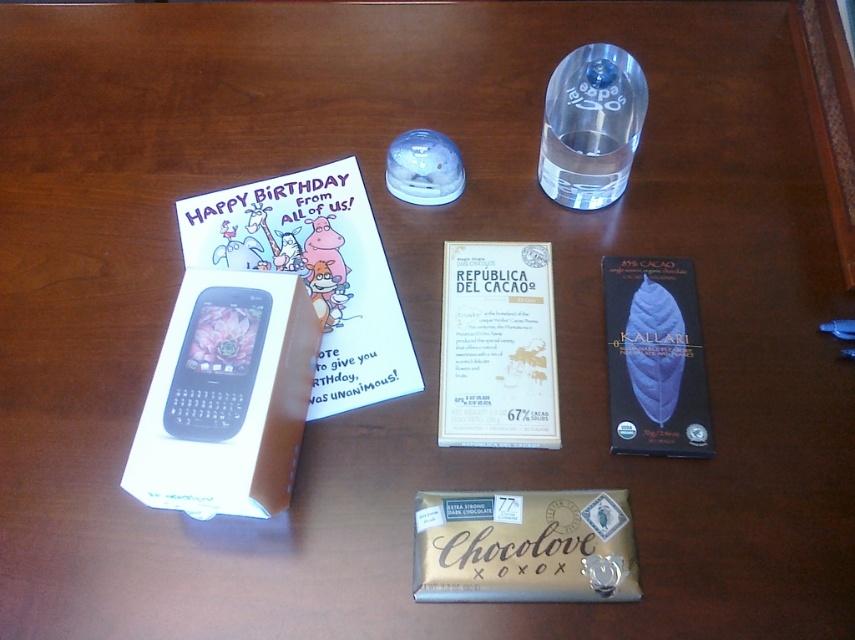
Is gold foil chocolate bar at center wider than dark chocolate bar at center right?

Correct, the width of gold foil chocolate bar at center exceeds that of dark chocolate bar at center right.

Is point (417, 573) positioned behind point (617, 369)?

No, it is in front of (617, 369).

Who is more distant from viewer, (466, 540) or (687, 384)?

Positioned behind is point (687, 384).

Locate an element on the screen. This screenshot has width=855, height=640. gold foil chocolate bar at center is located at coordinates (523, 547).

Who is shorter, gold foil chocolate bar at center or transparent glass bottle at upper center?

Standing shorter between the two is gold foil chocolate bar at center.

You are a GUI agent. You are given a task and a screenshot of the screen. Output one action in this format:
    pyautogui.click(x=<x>, y=<y>)
    Task: Click on the gold foil chocolate bar at center
    This screenshot has width=855, height=640.
    Given the screenshot: What is the action you would take?
    pyautogui.click(x=523, y=547)

Who is positioned more to the right, dark chocolate bar at center right or transparent glass bottle at upper center?

Positioned to the right is dark chocolate bar at center right.

You are a GUI agent. You are given a task and a screenshot of the screen. Output one action in this format:
    pyautogui.click(x=<x>, y=<y>)
    Task: Click on the dark chocolate bar at center right
    Image resolution: width=855 pixels, height=640 pixels.
    Given the screenshot: What is the action you would take?
    pyautogui.click(x=653, y=358)

The image size is (855, 640). Find the location of `dark chocolate bar at center right`. dark chocolate bar at center right is located at coordinates (653, 358).